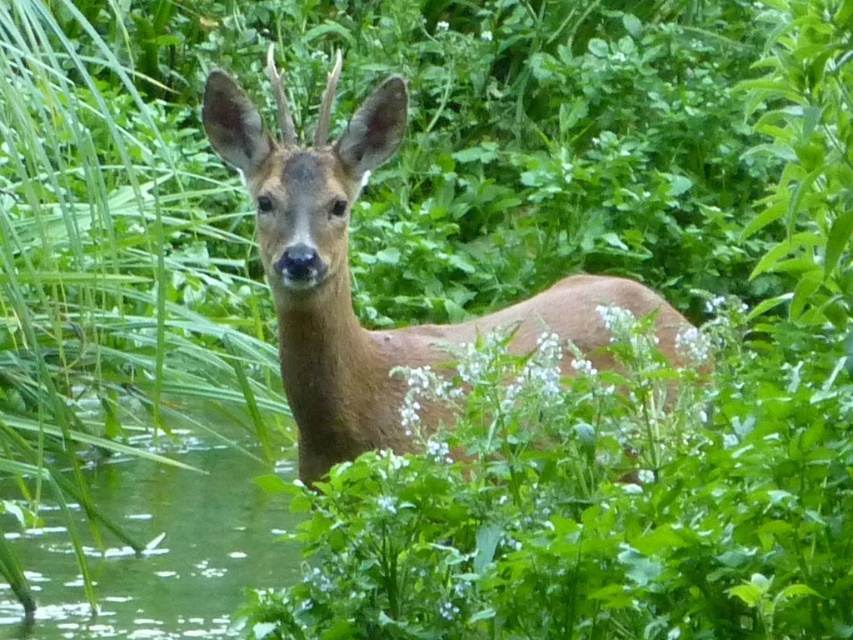
You are a hiker trying to locate two points marked in the scene. The first point is at coordinates point(291, 273) and the second is at point(97, 589). From your vantage point, which point is closer to you?

Point(291, 273) is in front of point(97, 589), so it is closer to you.

You are a wildlife photographer aiming to capture the brown matte deer at center in a photo. Based on its position, where should you focus your camera lens to ensure the deer is centered in your shot?

To center the brown matte deer at center in the photo, focus your camera lens on the coordinates point specified at its position, which is point (349, 275).

You are an animal tracker trying to determine if the brown matte deer at center can fit through a narrow gap between two trees. The gap is as wide as the green liquid water at lower left. Can the deer pass through the gap?

The brown matte deer at center might be wider than the green liquid water at lower left, so it may not be able to pass through the gap safely.